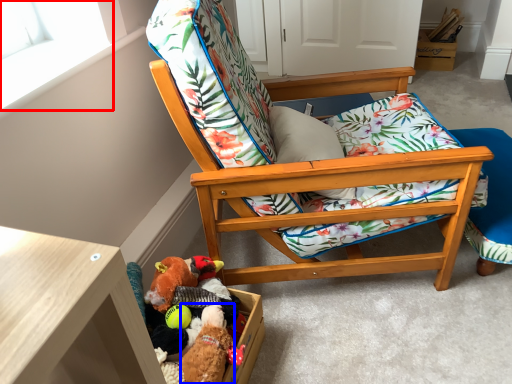
Question: Among these objects, which one is nearest to the camera, window screen (highlighted by a red box) or toy (highlighted by a blue box)?

Choices:
 (A) window screen
 (B) toy

Answer: (A)